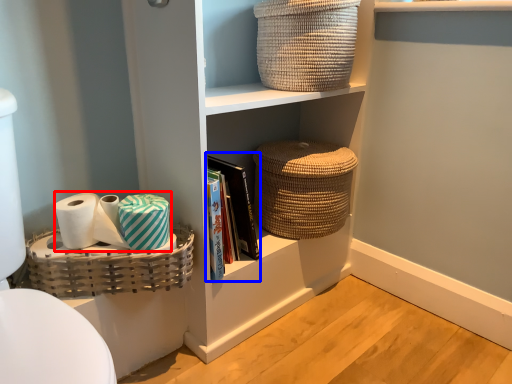
Question: Among these objects, which one is nearest to the camera, toilet paper (highlighted by a red box) or book (highlighted by a blue box)?

Choices:
 (A) toilet paper
 (B) book

Answer: (A)